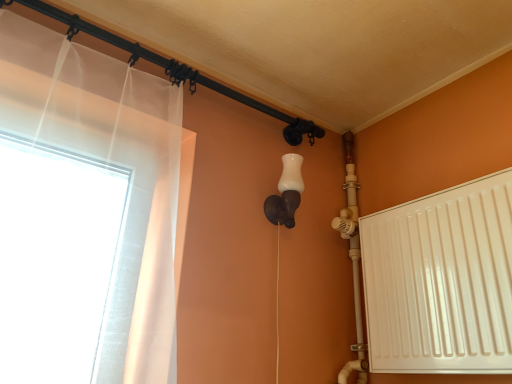
Question: Is black metal pipe at upper left taller than white matte radiator at right?

Choices:
 (A) yes
 (B) no

Answer: (B)

Question: Could you tell me if black metal pipe at upper left is turned towards white matte radiator at right?

Choices:
 (A) no
 (B) yes

Answer: (A)

Question: Is the position of black metal pipe at upper left less distant than that of white matte radiator at right?

Choices:
 (A) no
 (B) yes

Answer: (A)

Question: From the image's perspective, is black metal pipe at upper left under white matte radiator at right?

Choices:
 (A) no
 (B) yes

Answer: (A)

Question: Does black metal pipe at upper left have a smaller size compared to white matte radiator at right?

Choices:
 (A) no
 (B) yes

Answer: (B)

Question: In the image, is black metal pipe at upper left on the left side or the right side of white matte wall sconce at center?

Choices:
 (A) left
 (B) right

Answer: (A)

Question: In terms of width, does black metal pipe at upper left look wider or thinner when compared to white matte wall sconce at center?

Choices:
 (A) wide
 (B) thin

Answer: (B)

Question: Which is correct: black metal pipe at upper left is inside white matte wall sconce at center, or outside of it?

Choices:
 (A) outside
 (B) inside

Answer: (A)

Question: From a real-world perspective, is black metal pipe at upper left physically located above or below white matte wall sconce at center?

Choices:
 (A) above
 (B) below

Answer: (A)

Question: From a real-world perspective, is white matte radiator at right positioned above or below white matte wall sconce at center?

Choices:
 (A) below
 (B) above

Answer: (A)

Question: Is white matte radiator at right situated inside white matte wall sconce at center or outside?

Choices:
 (A) outside
 (B) inside

Answer: (A)

Question: Is white matte radiator at right bigger or smaller than white matte wall sconce at center?

Choices:
 (A) small
 (B) big

Answer: (B)

Question: From the image's perspective, is white matte radiator at right located above or below white matte wall sconce at center?

Choices:
 (A) below
 (B) above

Answer: (A)

Question: Is point (148, 52) positioned closer to the camera than point (384, 251)?

Choices:
 (A) closer
 (B) farther

Answer: (B)

Question: Based on their sizes in the image, would you say black metal pipe at upper left is bigger or smaller than white matte radiator at right?

Choices:
 (A) big
 (B) small

Answer: (B)